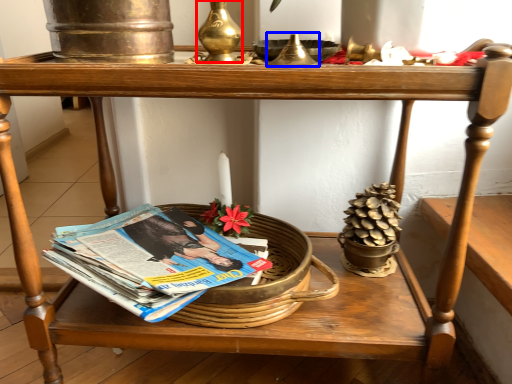
Question: Which of the following is the closest to the observer, candle holder (highlighted by a red box) or candle holder (highlighted by a blue box)?

Choices:
 (A) candle holder
 (B) candle holder

Answer: (B)